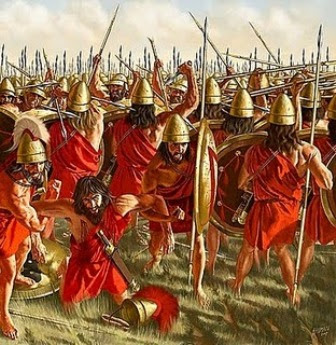
Locate an element on the screen. leg is located at coordinates (249, 258), (197, 254), (287, 272), (157, 242), (5, 284).